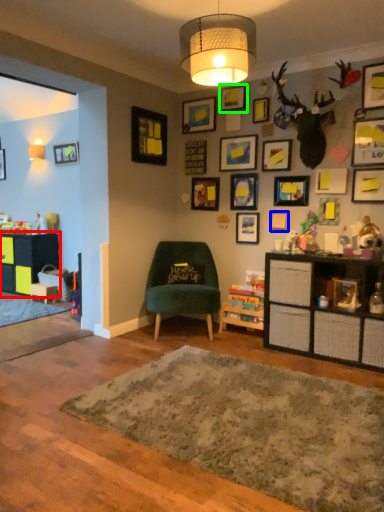
Question: Considering the real-world distances, which object is closest to cabinetry (highlighted by a red box)? picture frame (highlighted by a blue box) or picture frame (highlighted by a green box).

Choices:
 (A) picture frame
 (B) picture frame

Answer: (B)